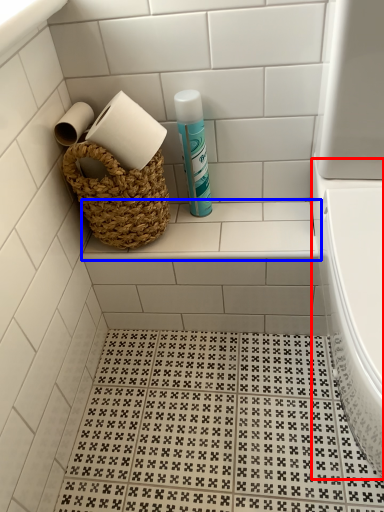
Question: Among these objects, which one is farthest to the camera, bath (highlighted by a red box) or ledge (highlighted by a blue box)?

Choices:
 (A) bath
 (B) ledge

Answer: (B)